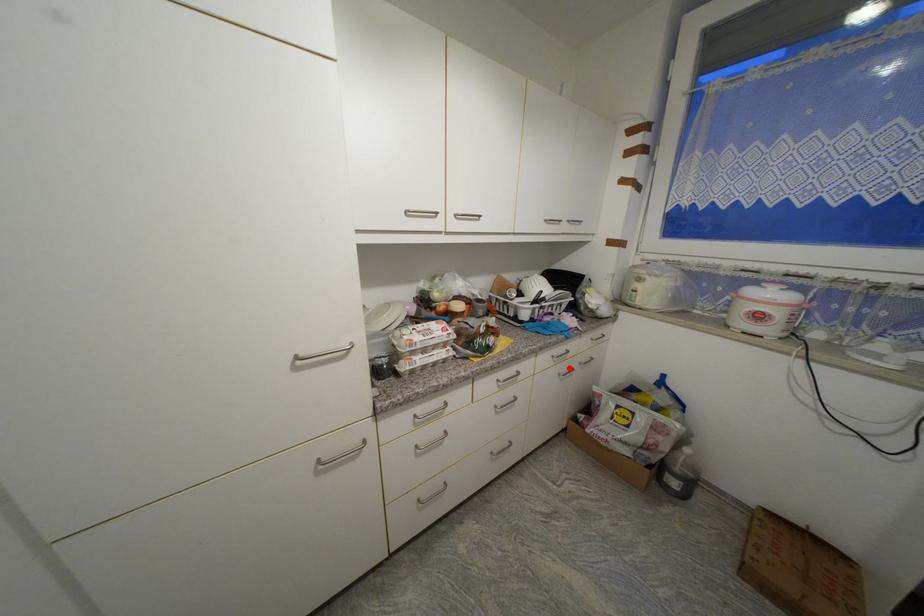
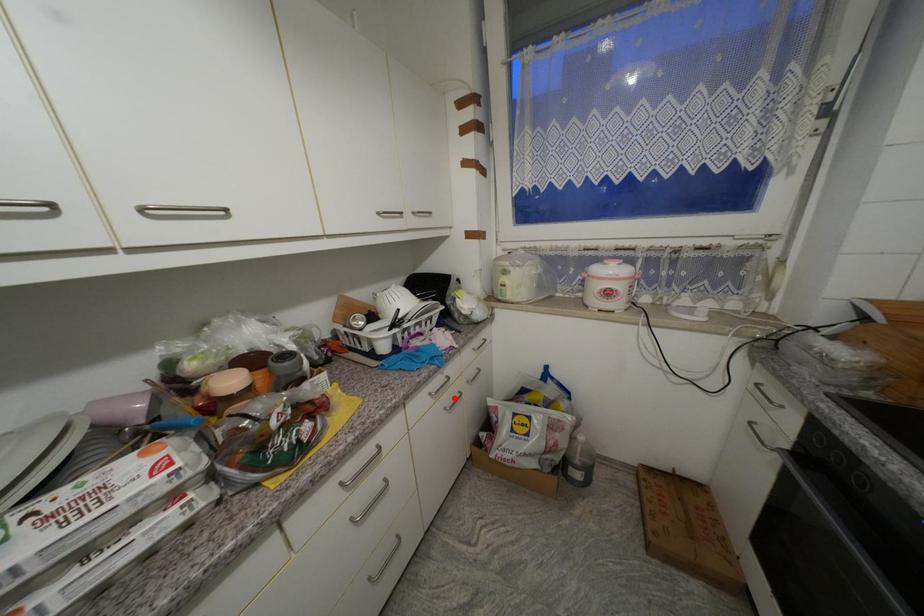
I am providing you with two images of the same scene from different viewpoints. A red point is marked on the first image and another point is marked on the second image. Does the point marked in image1 correspond to the same location as the one in image2?

Yes